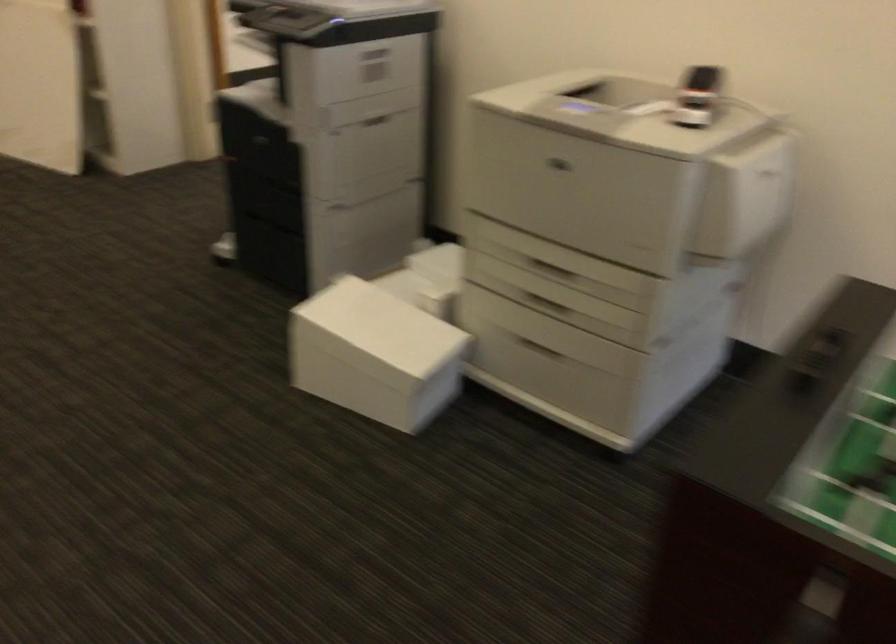
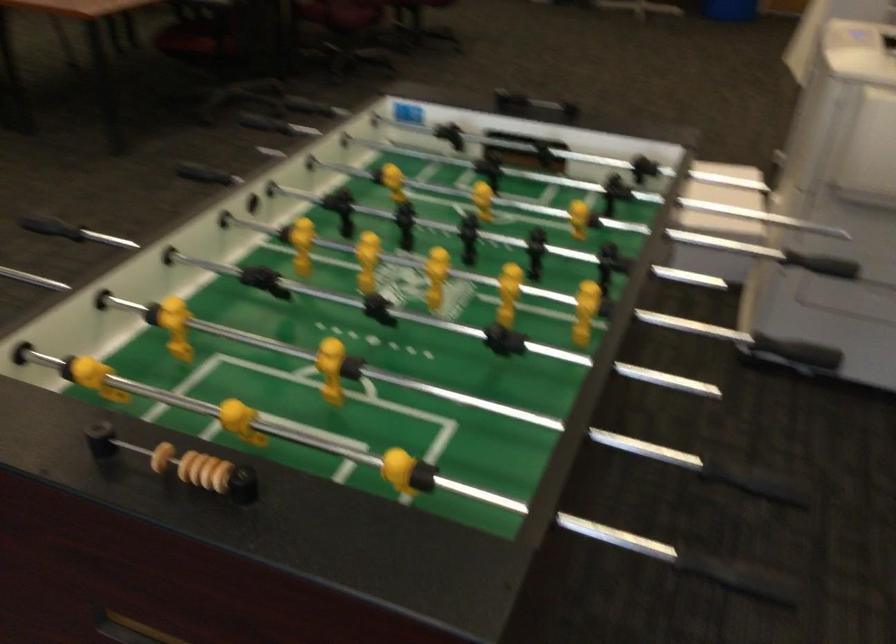
Question: I am providing you with two images of the same scene from different viewpoints. Which of the following objects are not visible in image2?

Choices:
 (A) black rod handle
 (B) square book
 (C) printer drawer handle
 (D) wooden scoring bead

Answer: (C)